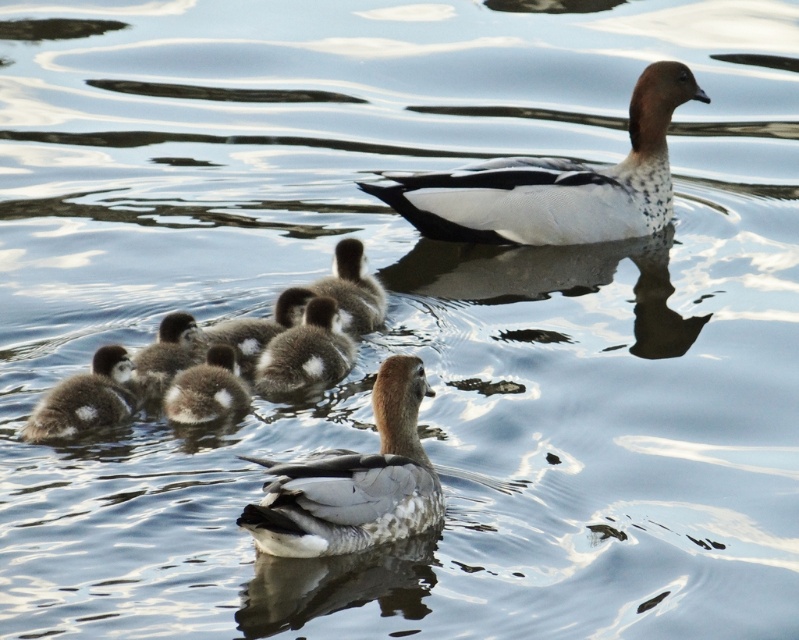
Question: Based on their relative distances, which object is farther from the brown fuzzy duckling at lower left?

Choices:
 (A) speckled gray duckling at center
 (B) brown fluffy duckling at center
 (C) brown fuzzy duckling at lower center
 (D) white speckled feathers at upper right

Answer: (D)

Question: Does speckled downy duckling at lower left have a larger size compared to brown downy duckling at center?

Choices:
 (A) yes
 (B) no

Answer: (B)

Question: Is speckled gray duckling at center in front of brown fuzzy duckling at lower center?

Choices:
 (A) no
 (B) yes

Answer: (B)

Question: Among these points, which one is nearest to the camera?

Choices:
 (A) (171, 342)
 (B) (340, 326)
 (C) (233, 348)

Answer: (C)

Question: Is brown downy duckling at center above brown fuzzy duckling at lower left?

Choices:
 (A) no
 (B) yes

Answer: (B)

Question: Based on their relative distances, which object is farther from the brown fuzzy duckling at lower left?

Choices:
 (A) brown fuzzy duckling at lower center
 (B) brown downy duckling at center
 (C) speckled gray duckling at center

Answer: (C)